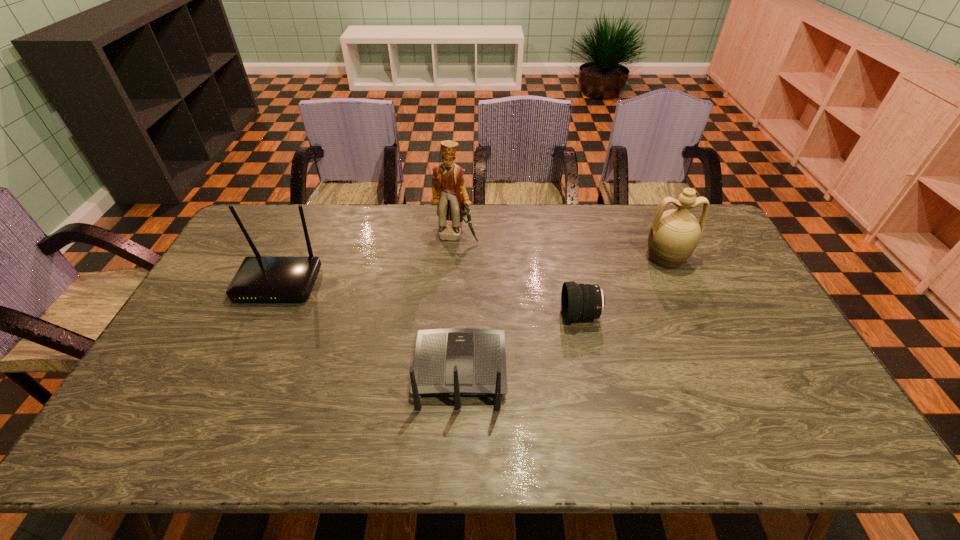
In order to click on vacant space positioned on the front-facing side of the leftmost object in this screenshot , I will do `click(234, 380)`.

Locate an element on the screen. The image size is (960, 540). vacant point located 0.220m on the front-facing side of the fourth tallest object is located at coordinates (464, 282).

Identify the location of free spot located 0.320m on the front-facing side of the fourth tallest object. This screenshot has width=960, height=540. (465, 261).

The image size is (960, 540). Identify the location of blank space located 0.300m on the front-facing side of the fourth tallest object. (465, 265).

What are the coordinates of `free spot located at the front element of the second object from right to left` in the screenshot? It's located at (453, 315).

The width and height of the screenshot is (960, 540). I want to click on vacant space located at the front element of the second object from right to left, so click(x=464, y=315).

Locate an element on the screen. This screenshot has width=960, height=540. vacant space located at the front element of the second object from right to left is located at coordinates (508, 315).

Identify the location of nutcracker at the far edge. This screenshot has width=960, height=540. (448, 188).

The image size is (960, 540). I want to click on pitcher at the far edge, so click(x=674, y=234).

Find the location of a particular element. The image size is (960, 540). object at the left edge is located at coordinates (259, 278).